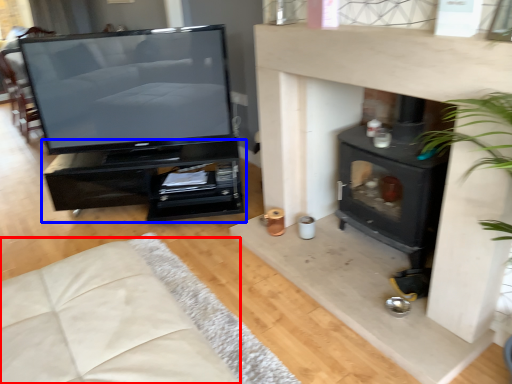
Question: Which object appears farthest to the camera in this image, couch (highlighted by a red box) or furniture (highlighted by a blue box)?

Choices:
 (A) couch
 (B) furniture

Answer: (B)